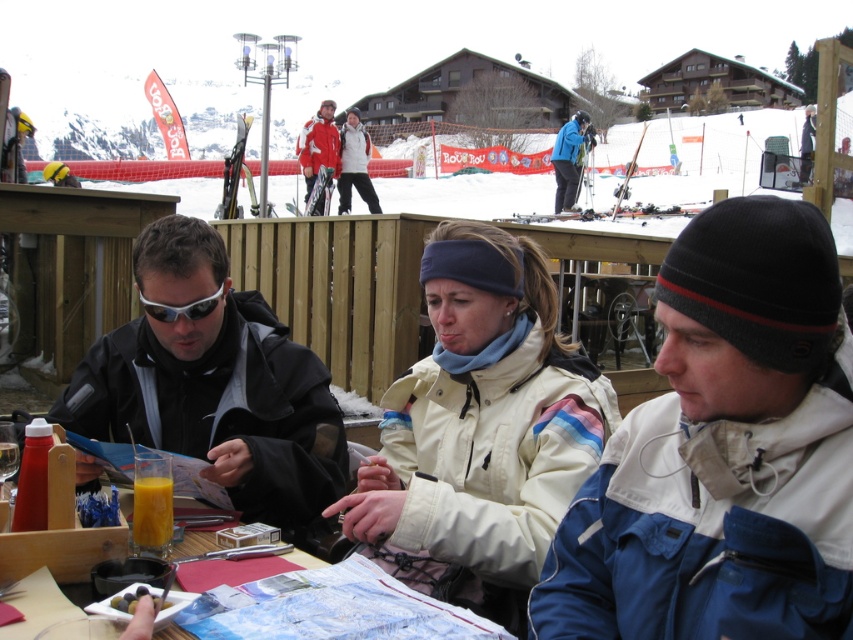
Can you confirm if blue/white jacket at center is thinner than matte red jacket at upper center?

Yes.

Locate an element on the screen. This screenshot has width=853, height=640. blue/white jacket at center is located at coordinates (723, 449).

I want to click on blue/white jacket at center, so click(x=723, y=449).

Can you confirm if white softshell jacket at center is bigger than matte black goggles at center?

Yes.

Can you confirm if white softshell jacket at center is shorter than matte black goggles at center?

No, white softshell jacket at center is not shorter than matte black goggles at center.

Is point (425, 390) behind point (186, 316)?

Yes, it is behind point (186, 316).

At what (x,y) coordinates should I click in order to perform the action: click on white softshell jacket at center. Please return your answer as a coordinate pair (x, y). The width and height of the screenshot is (853, 640). Looking at the image, I should click on (480, 429).

Does point (317, 156) lie in front of point (567, 173)?

Yes, it is in front of point (567, 173).

At what (x,y) coordinates should I click in order to perform the action: click on matte red jacket at upper center. Please return your answer as a coordinate pair (x, y). The width and height of the screenshot is (853, 640). Looking at the image, I should click on (318, 145).